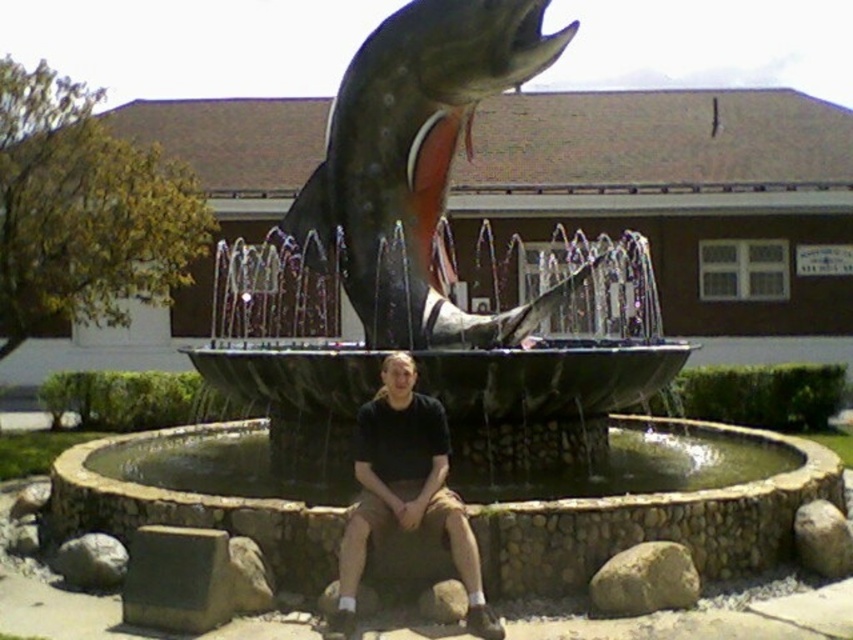
Measure the distance between black cotton shirt at center and camera.

black cotton shirt at center and camera are 4.55 meters apart from each other.

Measure the distance from black cotton shirt at center to gray rock at lower right.

The distance of black cotton shirt at center from gray rock at lower right is 8.05 feet.

Who is more forward, (412, 406) or (840, 577)?

Point (412, 406) is in front.

Where is `black cotton shirt at center`? The height and width of the screenshot is (640, 853). black cotton shirt at center is located at coordinates (405, 492).

Does shiny metallic fish at center come in front of brown rough rock at lower right?

That is False.

Is point (515, 10) less distant than point (666, 593)?

No.

Who is more forward, (331, 230) or (604, 589)?

Point (604, 589) is in front.

Image resolution: width=853 pixels, height=640 pixels. What are the coordinates of `shiny metallic fish at center` in the screenshot? It's located at (416, 160).

Between gray rock at lower left and gray rock at lower center, which one is positioned lower?

gray rock at lower center is lower down.

Is gray rock at lower left to the left of gray rock at lower center from the viewer's perspective?

Correct, you'll find gray rock at lower left to the left of gray rock at lower center.

The height and width of the screenshot is (640, 853). What are the coordinates of `gray rock at lower left` in the screenshot? It's located at (91, 561).